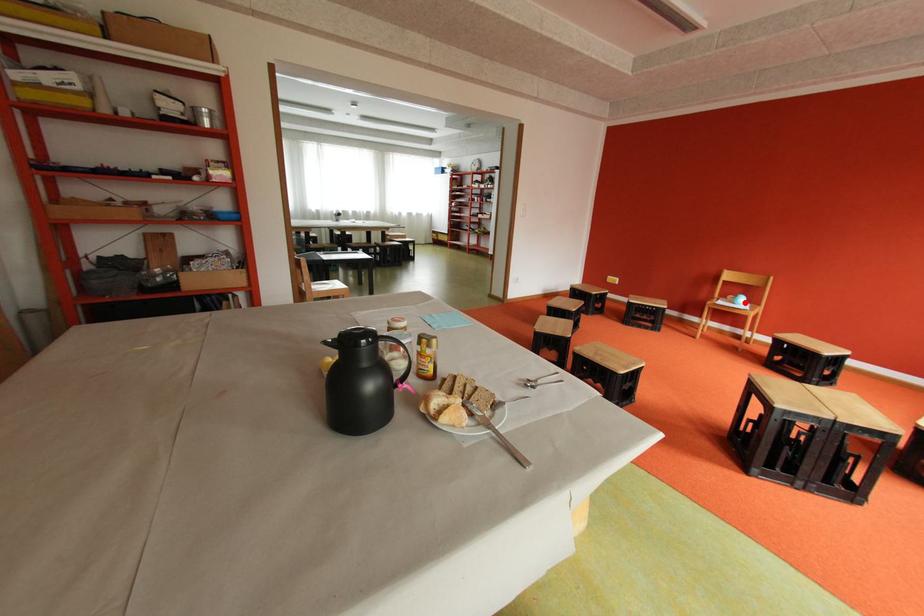
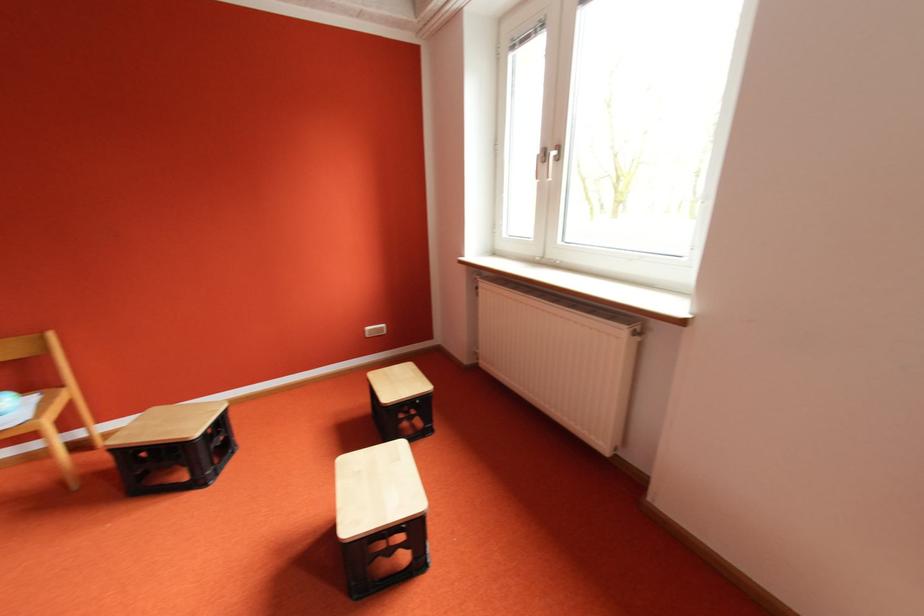
Question: I am providing you with two images of the same scene from different viewpoints. Image1 has a red point marked. In image2, the corresponding 3D location appears at what relative position? Reply with the corresponding letter.

Choices:
 (A) Closer
 (B) Farther

Answer: (A)